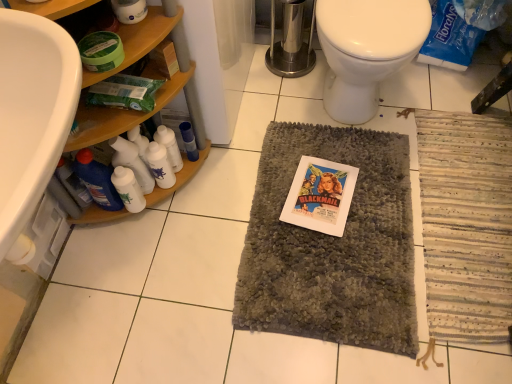
You are a GUI agent. You are given a task and a screenshot of the screen. Output one action in this format:
    pyautogui.click(x=<x>, y=<y>)
    Task: Click on the free space that is to the left of white glossy bottle at lower left, the second bottle in the left-to-right sequence
    The image size is (512, 384).
    Given the screenshot: What is the action you would take?
    pyautogui.click(x=94, y=235)